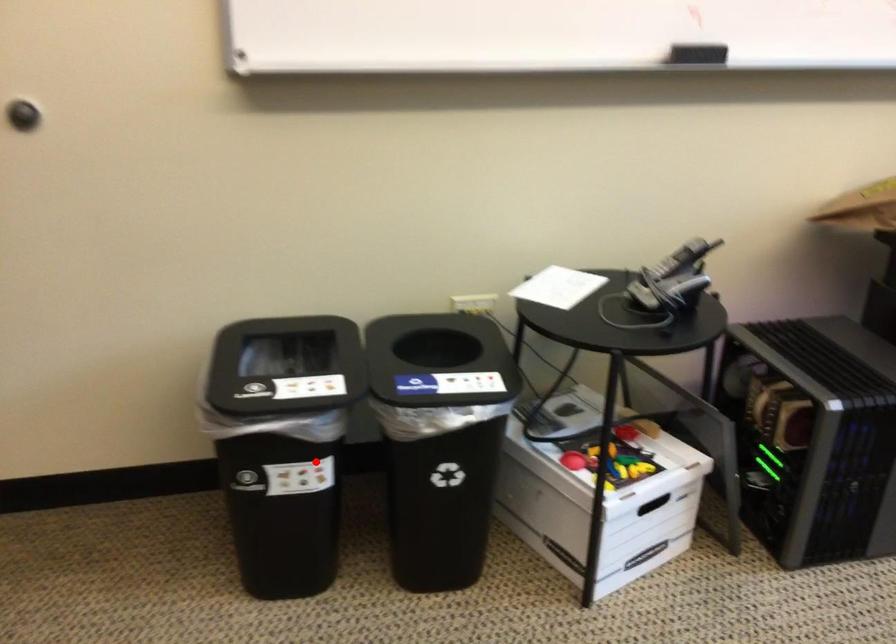
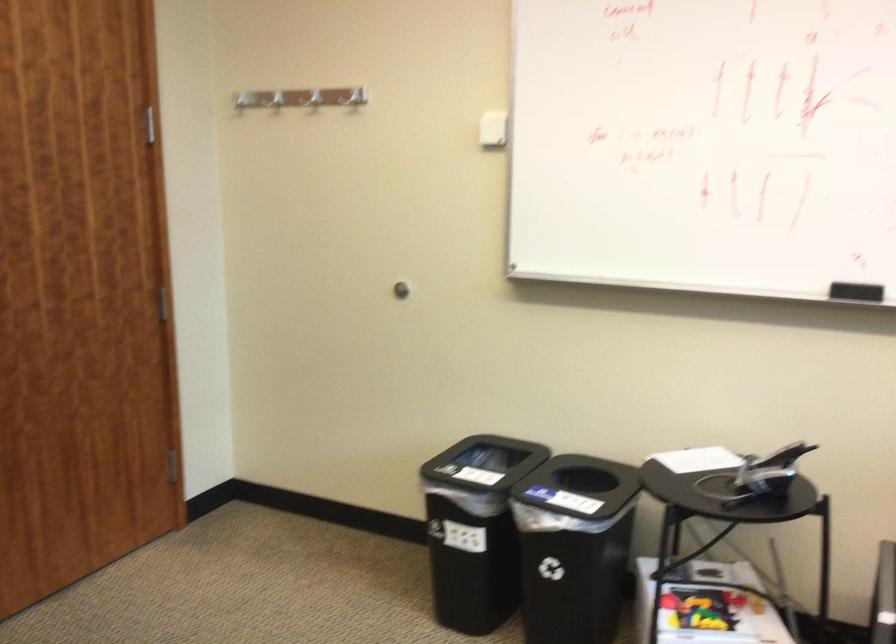
Question: A red point is marked in image1. In image2, is the corresponding 3D point closer to the camera or farther? Reply with the corresponding letter.

Choices:
 (A) The corresponding 3D point is closer.
 (B) The corresponding 3D point is farther.

Answer: (B)